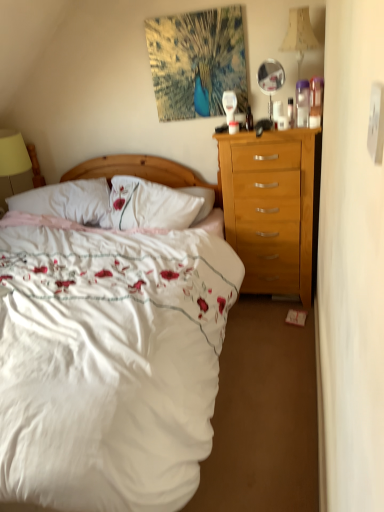
Question: Would you say white soft pillow at center is outside clear plastic bottle at upper right, which is the 2th bottle in back-to-front order?

Choices:
 (A) no
 (B) yes

Answer: (B)

Question: Can you confirm if white soft pillow at center is shorter than clear plastic bottle at upper right, the first bottle in the front-to-back sequence?

Choices:
 (A) yes
 (B) no

Answer: (B)

Question: Can you confirm if white soft pillow at center is taller than clear plastic bottle at upper right, the first bottle in the front-to-back sequence?

Choices:
 (A) yes
 (B) no

Answer: (A)

Question: Are white soft pillow at center and clear plastic bottle at upper right, which is the 2th bottle in back-to-front order, beside each other?

Choices:
 (A) no
 (B) yes

Answer: (A)

Question: Is clear plastic bottle at upper right, which is the 2th bottle in back-to-front order, completely or partially inside white soft pillow at center?

Choices:
 (A) no
 (B) yes

Answer: (A)

Question: From a real-world perspective, does white soft pillow at center sit lower than clear plastic bottle at upper right, the first bottle in the front-to-back sequence?

Choices:
 (A) yes
 (B) no

Answer: (A)

Question: From the image's perspective, is clear plastic bottle at upper right, the first bottle ordered from the bottom, beneath translucent plastic bottle at upper center, which is the 2th bottle in front-to-back order?

Choices:
 (A) yes
 (B) no

Answer: (A)

Question: Is clear plastic bottle at upper right, the first bottle ordered from the bottom, touching translucent plastic bottle at upper center, which appears as the first bottle when viewed from the top?

Choices:
 (A) no
 (B) yes

Answer: (A)

Question: Is clear plastic bottle at upper right, marked as the first bottle in a right-to-left arrangement, taller than translucent plastic bottle at upper center, arranged as the 1th bottle when viewed from the back?

Choices:
 (A) no
 (B) yes

Answer: (A)

Question: Considering the relative sizes of clear plastic bottle at upper right, the first bottle ordered from the bottom, and translucent plastic bottle at upper center, arranged as the second bottle when viewed from the right, in the image provided, is clear plastic bottle at upper right, the first bottle ordered from the bottom, shorter than translucent plastic bottle at upper center, arranged as the second bottle when viewed from the right,?

Choices:
 (A) yes
 (B) no

Answer: (A)

Question: Is clear plastic bottle at upper right, the second bottle from the left, turned away from translucent plastic bottle at upper center, which appears as the first bottle when viewed from the top?

Choices:
 (A) yes
 (B) no

Answer: (B)

Question: From a real-world perspective, is clear plastic bottle at upper right, the first bottle in the front-to-back sequence, physically below translucent plastic bottle at upper center, arranged as the second bottle when viewed from the right?

Choices:
 (A) no
 (B) yes

Answer: (B)

Question: Is translucent plastic bottle at upper center, positioned as the 1th bottle in left-to-right order, further to camera compared to yellow fabric lampshade at left, which is the second lamp from right to left?

Choices:
 (A) yes
 (B) no

Answer: (B)